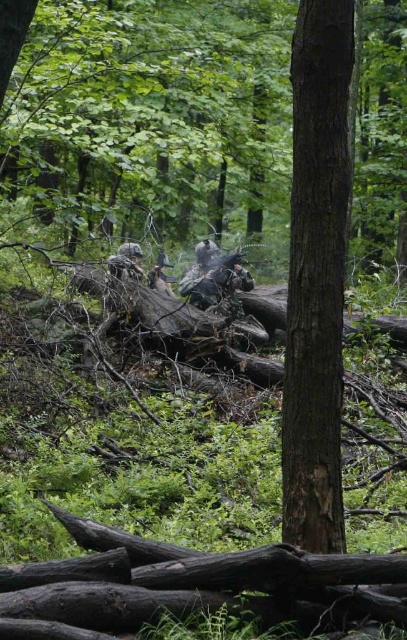
You are a hiker trying to navigate through the dense forest. You see a brown rough tree trunk at center and a dark brown wood log at center. Which one is smaller in size?

The brown rough tree trunk at center is smaller in size compared to the dark brown wood log at center.

You are navigating through a dense forest and need to locate the brown rough tree trunk at center. According to the coordinates provided, where exactly is it positioned?

The brown rough tree trunk at center is located at point (317,276).